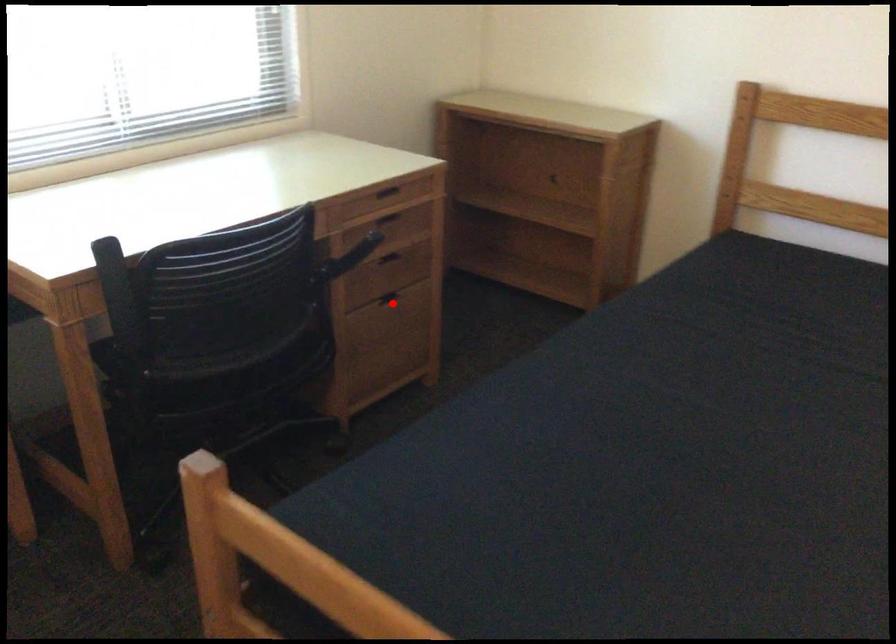
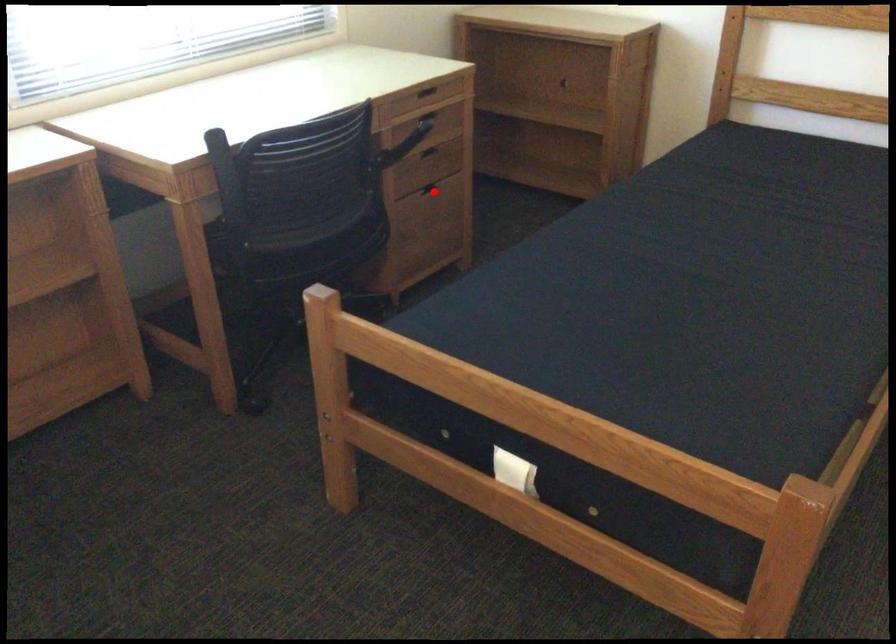
I am providing you with two images of the same scene from different viewpoints. A red point is marked on the first image and another point is marked on the second image. Are the points marked in image1 and image2 representing the same 3D position?

Yes